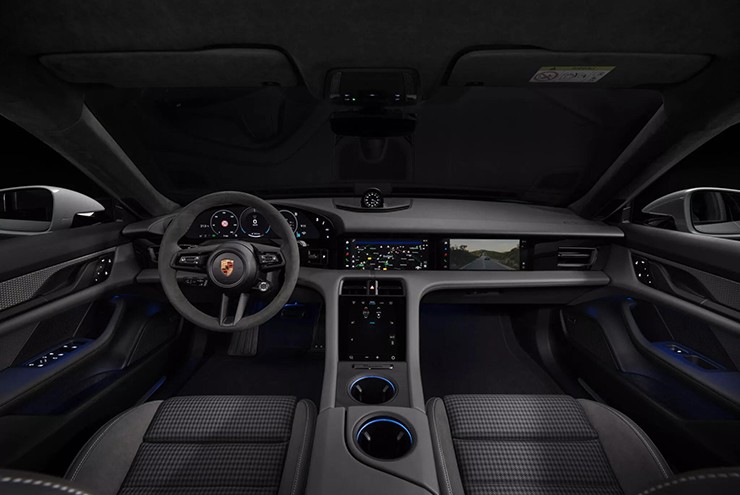
At what (x,y) coordinates should I click in order to perform the action: click on the right door. Please return your answer as a coordinate pair (x, y). This screenshot has height=495, width=740. Looking at the image, I should click on (682, 340).